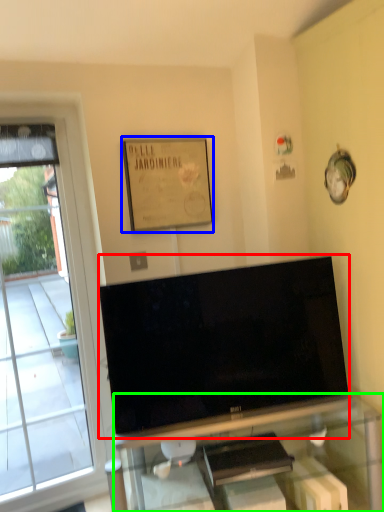
Question: Which object is positioned closest to television (highlighted by a red box)? Select from picture frame (highlighted by a blue box) and furniture (highlighted by a green box).

Choices:
 (A) picture frame
 (B) furniture

Answer: (B)